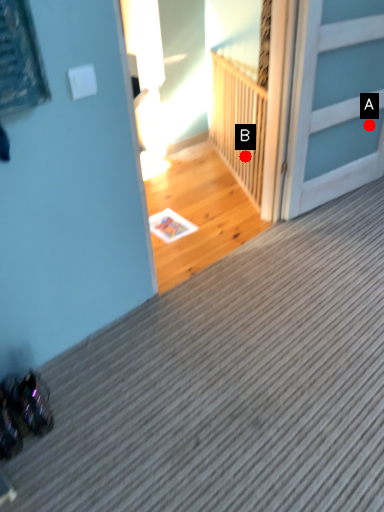
Question: Two points are circled on the image, labeled by A and B beside each circle. Which point appears farthest from the camera in this image?

Choices:
 (A) A is further
 (B) B is further

Answer: (B)